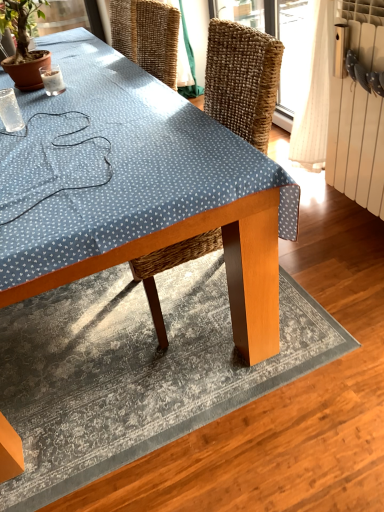
What are the coordinates of `spots to the right of clear glass coffee cup at upper left, which appears as the 1th coffee cup when viewed from the top` in the screenshot? It's located at (87, 89).